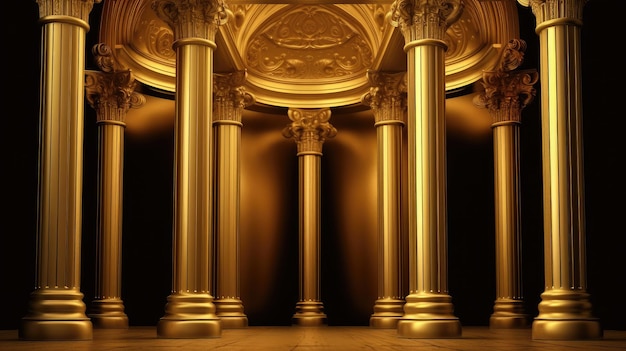
Locate an element on the screen. The height and width of the screenshot is (351, 626). shadow on wall is located at coordinates (473, 210), (603, 194), (531, 204), (336, 267), (284, 259), (143, 215), (93, 217).